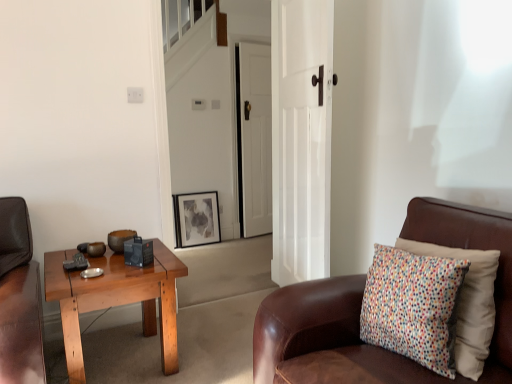
Question: Is matte black picture frame at center bigger than brown leather chair at right?

Choices:
 (A) no
 (B) yes

Answer: (A)

Question: Considering the relative sizes of matte black picture frame at center and brown leather chair at right in the image provided, is matte black picture frame at center shorter than brown leather chair at right?

Choices:
 (A) no
 (B) yes

Answer: (B)

Question: Considering the relative sizes of matte black picture frame at center and brown leather chair at right in the image provided, is matte black picture frame at center wider than brown leather chair at right?

Choices:
 (A) no
 (B) yes

Answer: (A)

Question: Can you confirm if matte black picture frame at center is smaller than brown leather chair at right?

Choices:
 (A) no
 (B) yes

Answer: (B)

Question: Would you say matte black picture frame at center is outside brown leather chair at right?

Choices:
 (A) yes
 (B) no

Answer: (A)

Question: Looking at their shapes, would you say white wooden door at center, which appears as the first door when viewed from the back, is wider or thinner than matte black picture frame at center?

Choices:
 (A) thin
 (B) wide

Answer: (B)

Question: Which is correct: white wooden door at center, which appears as the first door when viewed from the back, is inside matte black picture frame at center, or outside of it?

Choices:
 (A) inside
 (B) outside

Answer: (B)

Question: Is white wooden door at center, which appears as the first door when viewed from the back, in front of or behind matte black picture frame at center in the image?

Choices:
 (A) behind
 (B) front

Answer: (B)

Question: Visually, is white wooden door at center, which is the 2th door in front-to-back order, positioned to the left or to the right of matte black picture frame at center?

Choices:
 (A) left
 (B) right

Answer: (B)

Question: Which is correct: brown leather chair at right is inside wooden coffee table at left, or outside of it?

Choices:
 (A) outside
 (B) inside

Answer: (A)

Question: In the image, is brown leather chair at right on the left side or the right side of wooden coffee table at left?

Choices:
 (A) right
 (B) left

Answer: (A)

Question: In terms of width, does brown leather chair at right look wider or thinner when compared to wooden coffee table at left?

Choices:
 (A) thin
 (B) wide

Answer: (B)

Question: Looking at the image, does brown leather chair at right seem bigger or smaller compared to wooden coffee table at left?

Choices:
 (A) big
 (B) small

Answer: (A)

Question: From a real-world perspective, relative to white glossy door at center, positioned as the first door in front-to-back order, is white wooden door at center, which is the 2th door in front-to-back order, vertically above or below?

Choices:
 (A) below
 (B) above

Answer: (A)

Question: In the image, is white wooden door at center, which is the 2th door in front-to-back order, positioned in front of or behind white glossy door at center, placed as the 2th door when sorted from back to front?

Choices:
 (A) front
 (B) behind

Answer: (B)